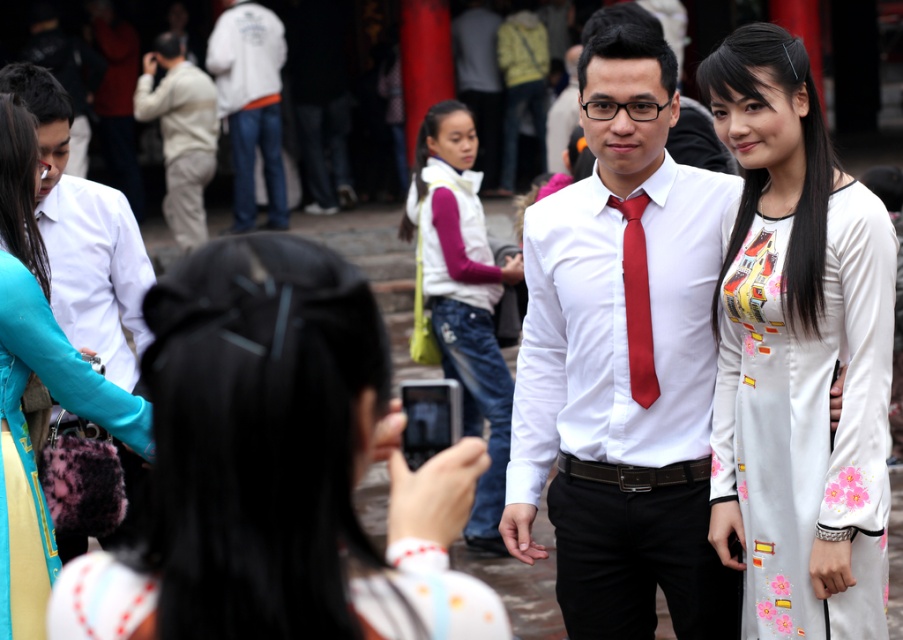
Can you confirm if white cotton dress at center is shorter than matte red tie at center?

Yes.

Who is positioned more to the left, white cotton dress at center or matte red tie at center?

white cotton dress at center is more to the left.

Does point (172, 492) lie behind point (636, 326)?

No.

Where is `white cotton dress at center`? Image resolution: width=903 pixels, height=640 pixels. white cotton dress at center is located at coordinates (277, 468).

Is turquoise fabric dress at left to the left of white cotton vest at center from the viewer's perspective?

Correct, you'll find turquoise fabric dress at left to the left of white cotton vest at center.

Which of these two, turquoise fabric dress at left or white cotton vest at center, stands shorter?

Standing shorter between the two is white cotton vest at center.

Identify the location of turquoise fabric dress at left. (42, 381).

Can you confirm if white silk dress at center is positioned to the left of white cotton vest at center?

In fact, white silk dress at center is to the right of white cotton vest at center.

Who is more forward, (x=794, y=54) or (x=467, y=280)?

Point (x=794, y=54) is in front.

Find the location of a particular element. This screenshot has width=903, height=640. white silk dress at center is located at coordinates tap(797, 355).